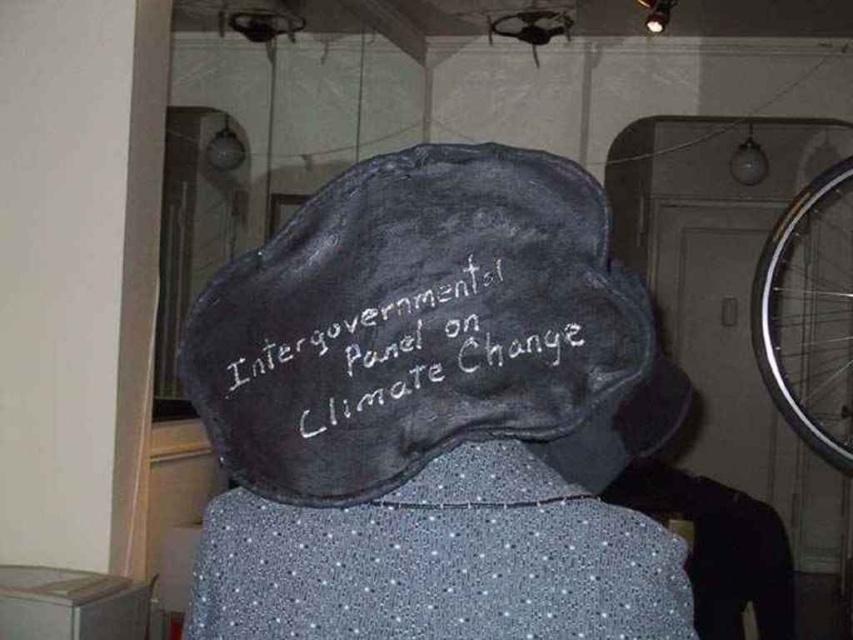
Question: Which of these objects is positioned farthest from the silver metallic bicycle wheel at right?

Choices:
 (A) dark gray felt baseball hat at center
 (B) black chalkboard at center

Answer: (B)

Question: Does black chalkboard at center appear on the left side of silver metallic bicycle wheel at right?

Choices:
 (A) no
 (B) yes

Answer: (B)

Question: Which point is closer to the camera taking this photo?

Choices:
 (A) (799, 394)
 (B) (357, 408)

Answer: (B)

Question: Does dark gray felt baseball hat at center have a greater width compared to black chalkboard at center?

Choices:
 (A) yes
 (B) no

Answer: (A)

Question: Which point appears closest to the camera in this image?

Choices:
 (A) (525, 376)
 (B) (770, 328)

Answer: (A)

Question: Does black chalkboard at center lie in front of silver metallic bicycle wheel at right?

Choices:
 (A) yes
 (B) no

Answer: (A)